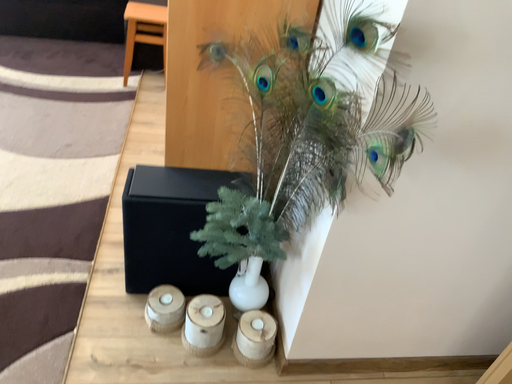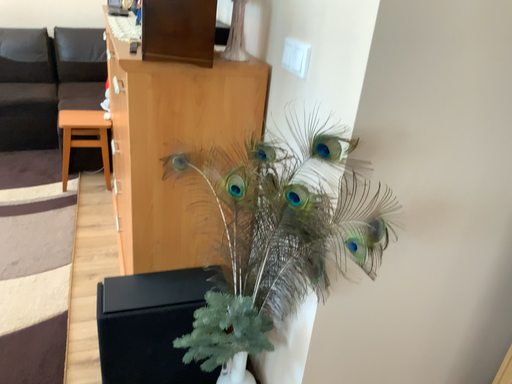
Question: How did the camera likely rotate when shooting the video?

Choices:
 (A) rotated left
 (B) rotated right

Answer: (B)